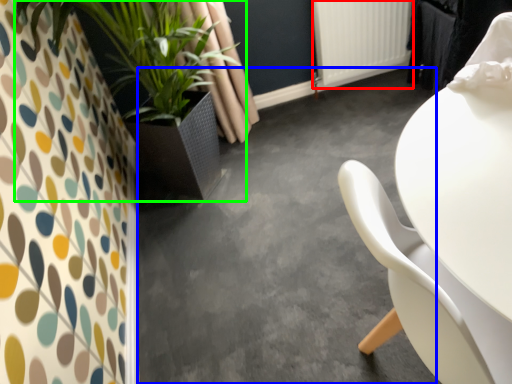
Question: Which object is the closest to the radiator (highlighted by a red box)? Choose among these: concrete (highlighted by a blue box) or houseplant (highlighted by a green box).

Choices:
 (A) concrete
 (B) houseplant

Answer: (A)